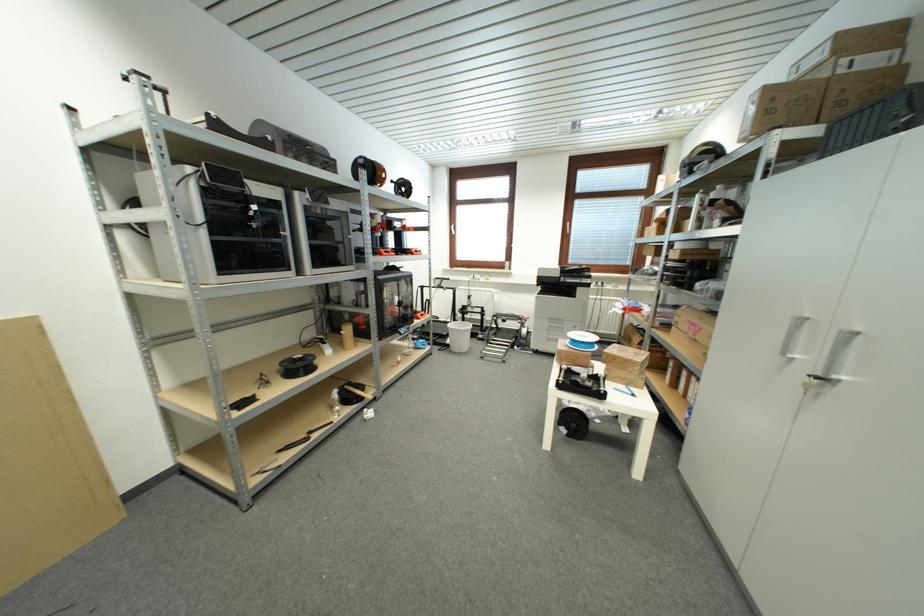
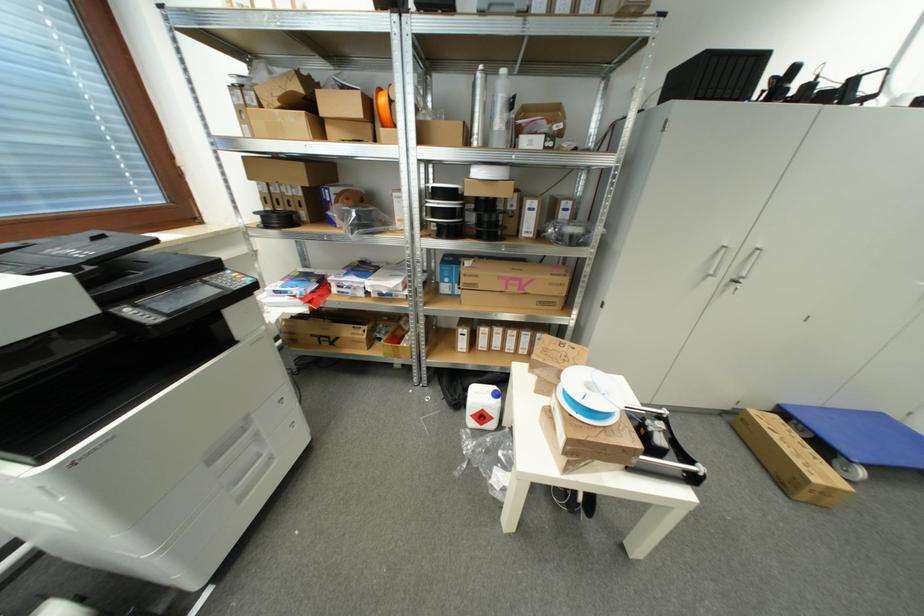
Find the pixel in the second image that matches point (696, 334) in the first image.

(517, 292)